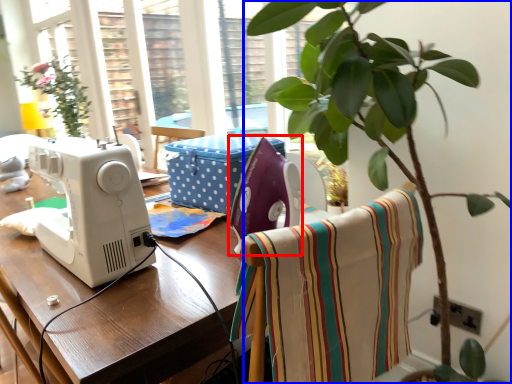
Question: Among these objects, which one is farthest to the camera, sewing machine (highlighted by a red box) or houseplant (highlighted by a blue box)?

Choices:
 (A) sewing machine
 (B) houseplant

Answer: (A)